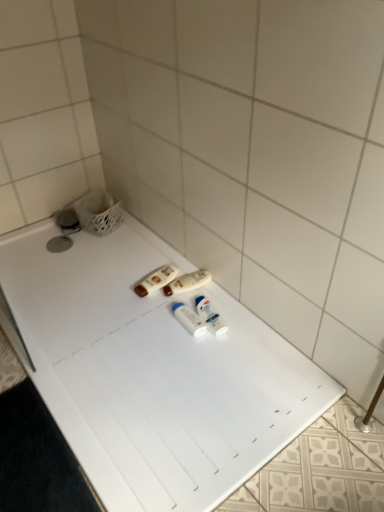
What are the coordinates of `vacant space that is to the left of white plastic bottles at center, the 3th toiletry when ordered from left to right` in the screenshot? It's located at (144, 326).